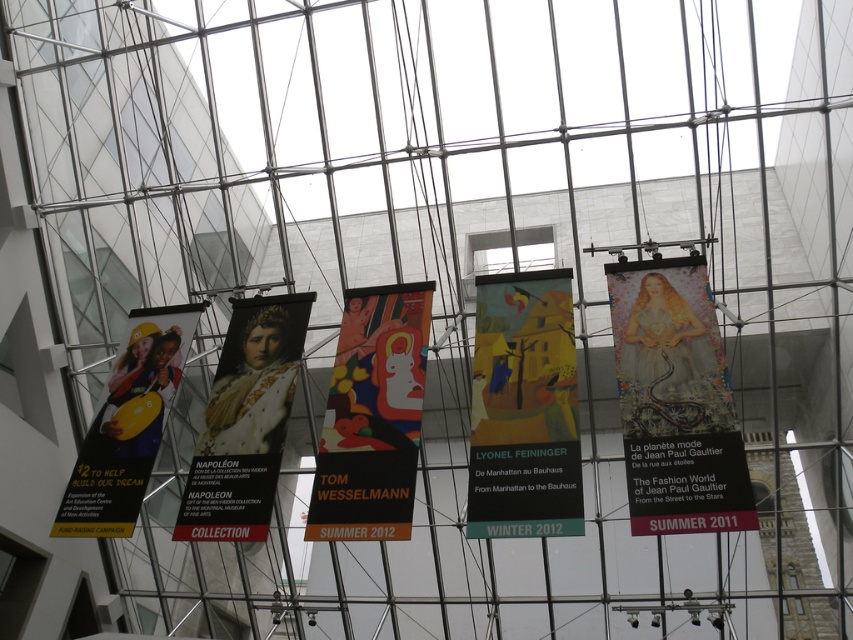
Can you confirm if matte gold portrait at center is smaller than matte yellow construction helmet at left?

Yes.

Locate an element on the screen. The image size is (853, 640). matte gold portrait at center is located at coordinates (245, 420).

Describe the element at coordinates (524, 410) in the screenshot. This screenshot has height=640, width=853. I see `matte yellow banner at center` at that location.

Is matte yellow banner at center taller than multicolored fabric banner at center?

In fact, matte yellow banner at center may be shorter than multicolored fabric banner at center.

Who is more forward, [527,413] or [376,435]?

Point [527,413] is more forward.

Locate an element on the screen. matte yellow banner at center is located at coordinates (524, 410).

This screenshot has width=853, height=640. What are the coordinates of `matte yellow banner at center` in the screenshot? It's located at (524, 410).

Does matte yellow banner at center have a lesser height compared to matte gold portrait at center?

Indeed, matte yellow banner at center has a lesser height compared to matte gold portrait at center.

The image size is (853, 640). In order to click on matte yellow banner at center in this screenshot , I will do [524, 410].